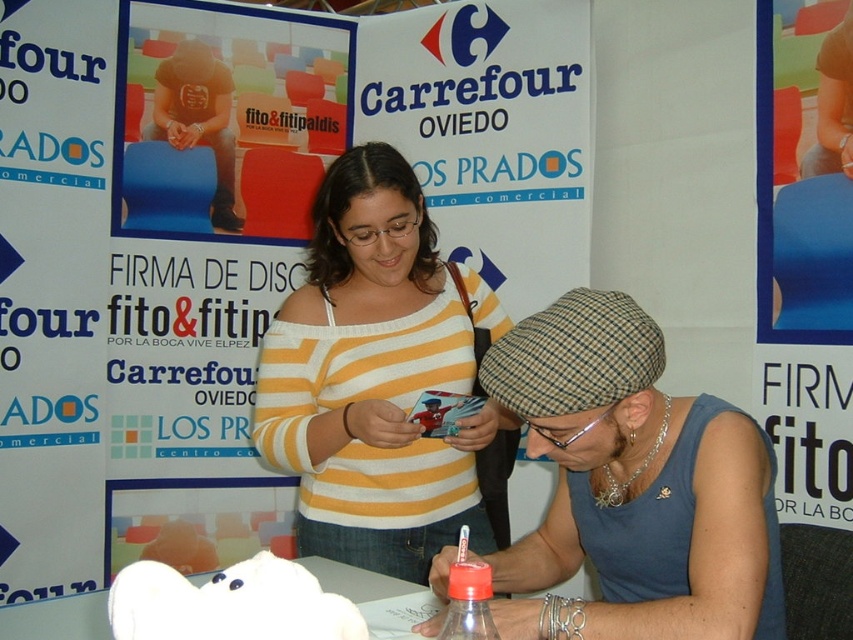
You are a photographer at the event and need to capture a closeup of the striped cotton shirt at center. The camera you are using has a minimum focusing distance of 40 inches. Will you be able to take the photo from your current position?

The striped cotton shirt at center is 39.37 inches away, which is within the camera minimum focusing distance of 40 inches. Yes, you can take the photo from your current position.

The striped cotton shirt at center is located at what coordinates?

The striped cotton shirt at center is located at coordinates point (x=633, y=484).

You are organizing a childrens savings workshop and need to place the striped cotton shirt at center and the white matte piggy bank at lower center on a table. According to the image, which object is closer to the front of the table?

The striped cotton shirt at center is closer to the front of the table because the white matte piggy bank at lower center is behind it.